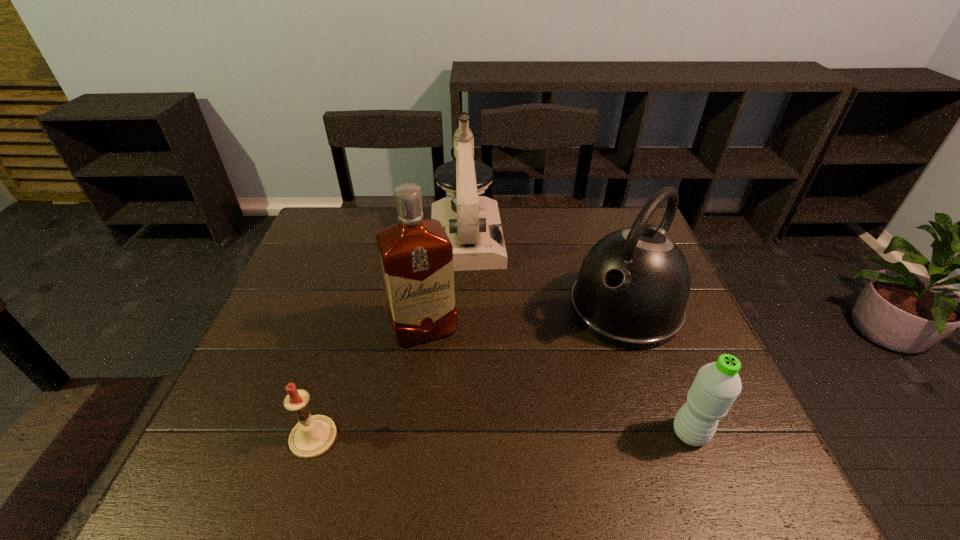
Where is `free space that is in between the kettle and the farthest object`? The height and width of the screenshot is (540, 960). free space that is in between the kettle and the farthest object is located at coordinates (546, 274).

The width and height of the screenshot is (960, 540). In order to click on vacant space in between the second shortest object and the liquor in this screenshot , I will do `click(557, 382)`.

Locate an element on the screen. Image resolution: width=960 pixels, height=540 pixels. vacant area that lies between the leftmost object and the fourth tallest object is located at coordinates (502, 435).

The width and height of the screenshot is (960, 540). Find the location of `vacant space in between the microscope and the kettle`. vacant space in between the microscope and the kettle is located at coordinates (546, 274).

Identify the location of vacant point located between the shortest object and the fourth tallest object. The image size is (960, 540). (502, 435).

Locate an element on the screen. free spot between the farthest object and the shortest object is located at coordinates (390, 338).

At what (x,y) coordinates should I click in order to perform the action: click on free space between the leftmost object and the kettle. Please return your answer as a coordinate pair (x, y). Image resolution: width=960 pixels, height=540 pixels. Looking at the image, I should click on (469, 373).

Locate an element on the screen. This screenshot has height=540, width=960. free space between the shortest object and the second shortest object is located at coordinates (502, 435).

I want to click on object that stands as the second closest to the fourth tallest object, so click(416, 255).

Where is `object that is the fourth closest to the liquor`? This screenshot has height=540, width=960. object that is the fourth closest to the liquor is located at coordinates (716, 386).